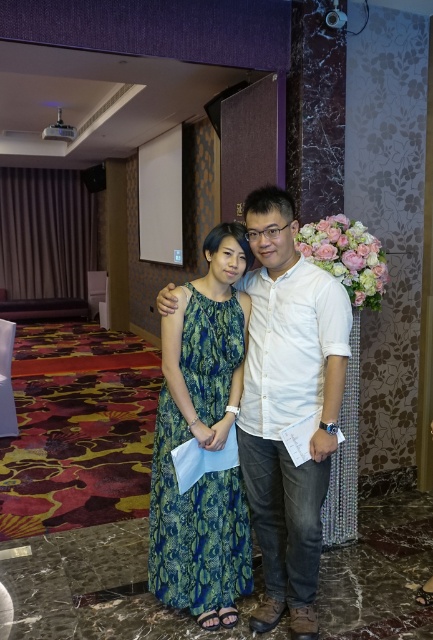
Question: Is white cotton shirt at center closer to the viewer compared to green snakeskin dress at center?

Choices:
 (A) no
 (B) yes

Answer: (B)

Question: Among these objects, which one is farthest from the camera?

Choices:
 (A) green snakeskin dress at center
 (B) white cotton shirt at center

Answer: (A)

Question: Which of the following is the farthest from the observer?

Choices:
 (A) green snakeskin dress at center
 (B) white cotton shirt at center

Answer: (A)

Question: Does white cotton shirt at center appear on the left side of green snakeskin dress at center?

Choices:
 (A) no
 (B) yes

Answer: (A)

Question: Can you confirm if white cotton shirt at center is bigger than green snakeskin dress at center?

Choices:
 (A) yes
 (B) no

Answer: (A)